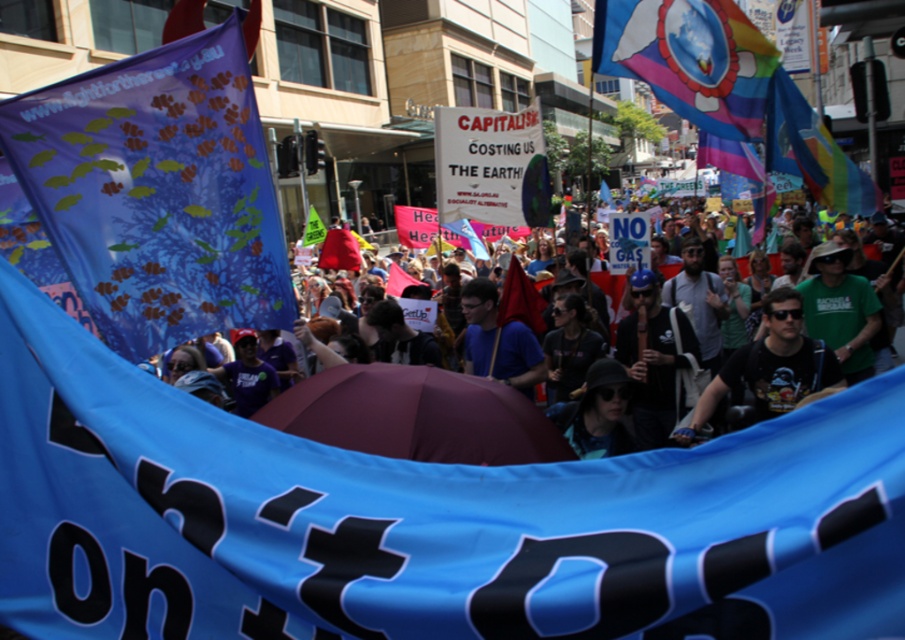
Question: Which point appears farthest from the camera in this image?

Choices:
 (A) (331, 352)
 (B) (761, 364)
 (C) (756, 125)

Answer: (B)

Question: Which point is farther to the camera?

Choices:
 (A) blue fabric banner with fish prints at left
 (B) rainbow fabric flag at upper right

Answer: (B)

Question: Is rainbow fabric flag at upper right below blue t-shirt at center?

Choices:
 (A) yes
 (B) no

Answer: (B)

Question: Estimate the real-world distances between objects in this image. Which object is farther from the blue fabric banner with fish prints at left?

Choices:
 (A) maroon fabric umbrella at center
 (B) blue t-shirt at center

Answer: (B)

Question: Does blue fabric crowd at center have a lesser width compared to maroon fabric umbrella at center?

Choices:
 (A) no
 (B) yes

Answer: (B)

Question: Does maroon fabric umbrella at center appear under black matte t-shirt at center?

Choices:
 (A) no
 (B) yes

Answer: (B)